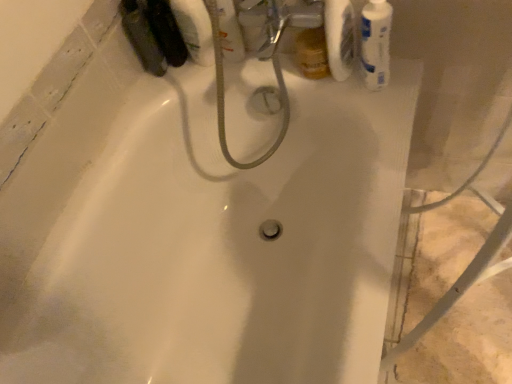
Find the location of a particular element. This screenshot has width=512, height=384. vacant area that is in front of white matte toilet paper at upper right is located at coordinates (374, 111).